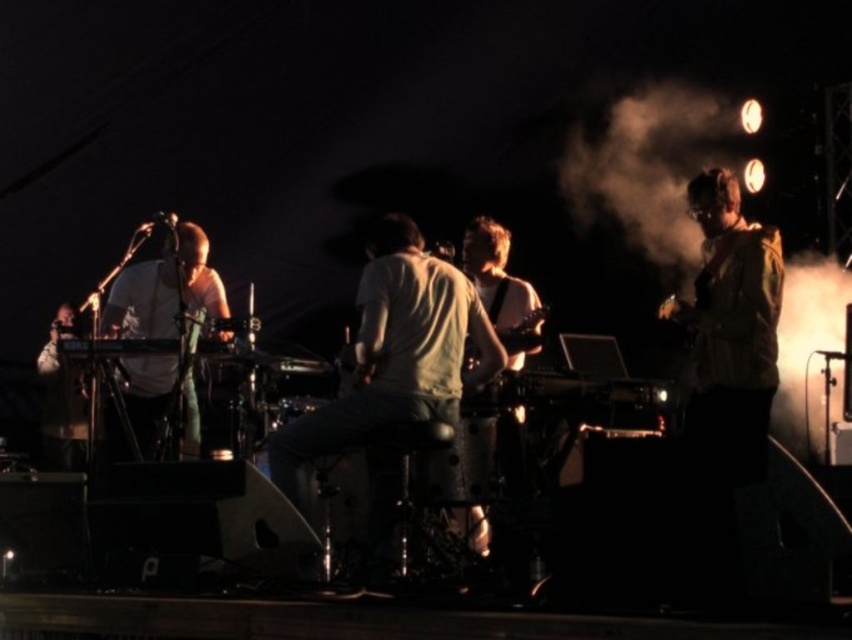
Question: Which point is closer to the camera?

Choices:
 (A) (137, 292)
 (B) (636, 168)
 (C) (53, 440)

Answer: (A)

Question: Does white matte shirt at center lie in front of matte white keyboard at left?

Choices:
 (A) yes
 (B) no

Answer: (A)

Question: Considering the relative positions of white fog at right and white matte shirt at center in the image provided, where is white fog at right located with respect to white matte shirt at center?

Choices:
 (A) left
 (B) right

Answer: (B)

Question: Based on their relative distances, which object is nearer to the white matte keyboard at center?

Choices:
 (A) matte white keyboard at left
 (B) white matte shirt at center
 (C) white fog at right

Answer: (A)

Question: Among these objects, which one is nearest to the camera?

Choices:
 (A) white fog at right
 (B) white matte shirt at center
 (C) white matte keyboard at center
 (D) matte white keyboard at left

Answer: (B)

Question: Where is white matte shirt at center located in relation to white matte keyboard at center in the image?

Choices:
 (A) right
 (B) left

Answer: (A)